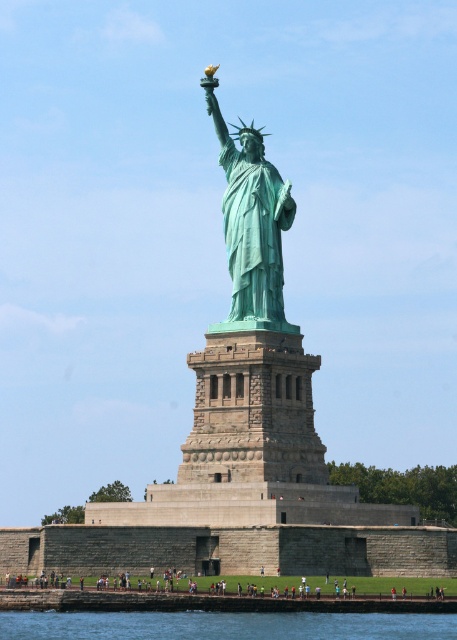
Does blue water at lower center have a lesser height compared to green patina statue at center?

Correct, blue water at lower center is not as tall as green patina statue at center.

Measure the distance between blue water at lower center and green patina statue at center.

blue water at lower center is 32.51 meters away from green patina statue at center.

Between point (281, 612) and point (229, 179), which one is positioned in front?

Point (281, 612) is more forward.

I want to click on blue water at lower center, so click(224, 625).